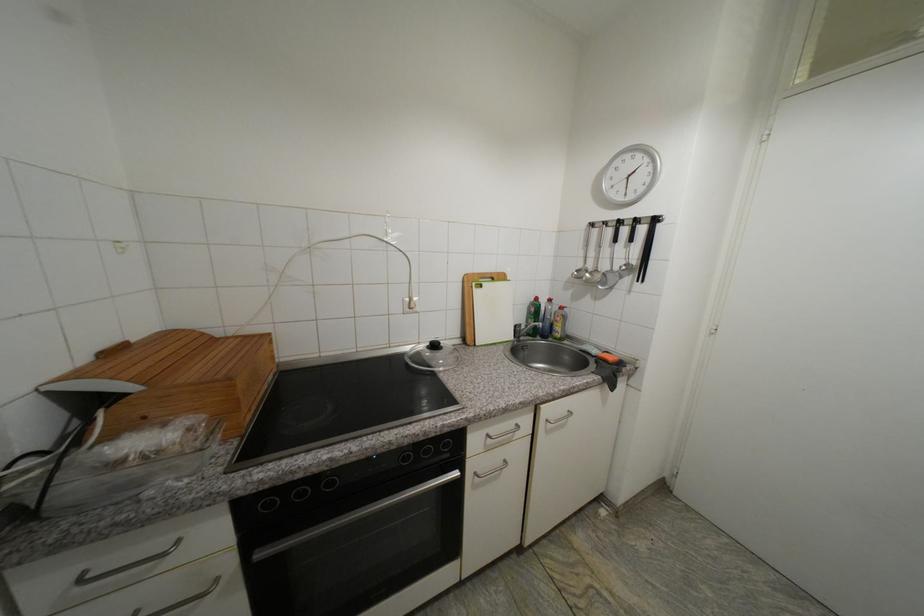
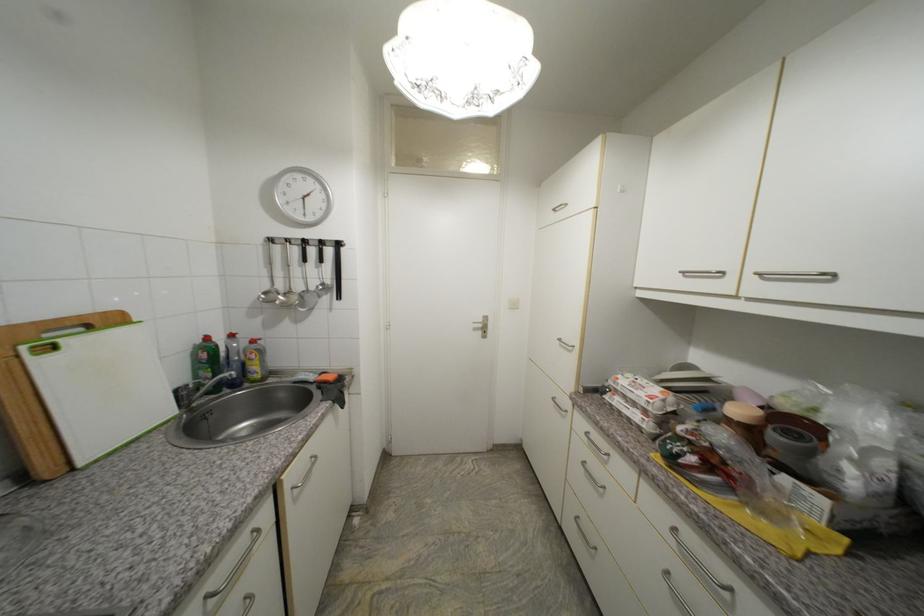
Locate, in the second image, the point that corresponds to the point at 586,267 in the first image.

(273, 288)